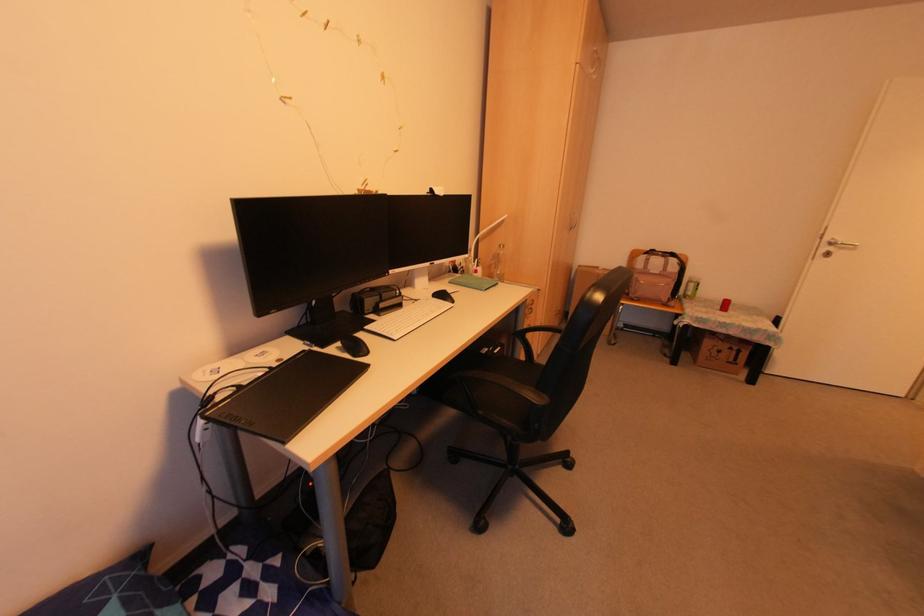
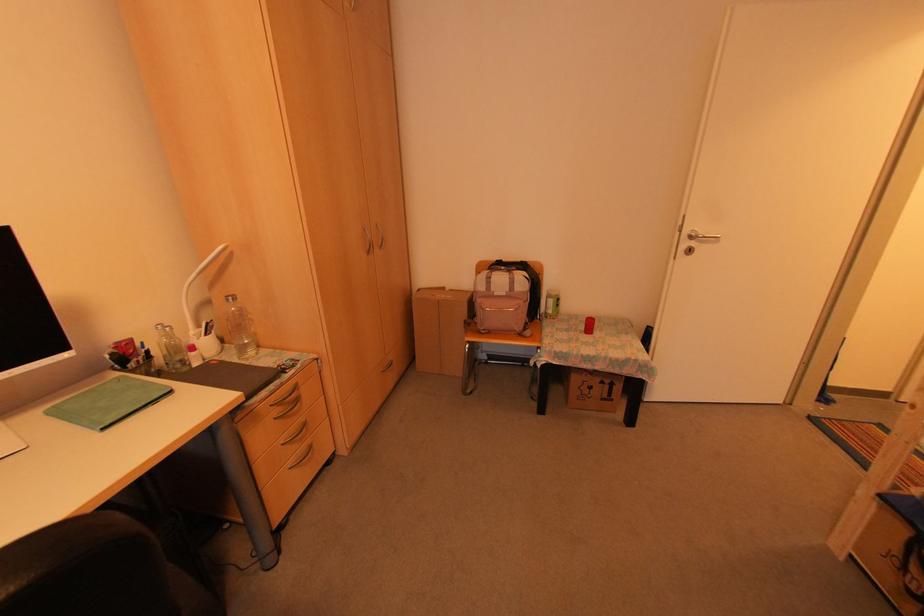
In the second image, find the point that corresponds to (683,296) in the first image.

(543, 314)